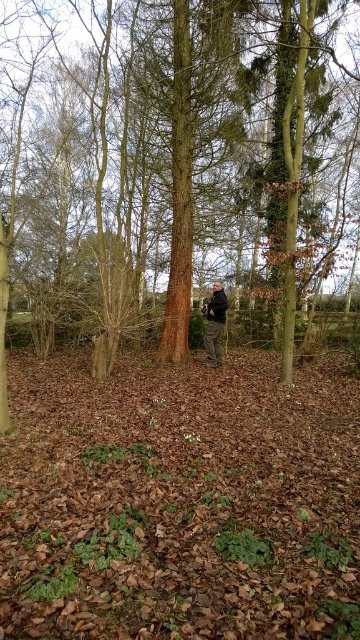
You are a hiker who has just spotted a brown wood tree at center and a dark gray jacket at center in the woods. Based on the scene, which object is higher up in the image?

The brown wood tree at center is above the dark gray jacket at center, so the brown wood tree at center is higher up in the image.

You are a hiker who has just spotted a brown wood tree at center and a dark gray jacket at center in the woodland. You want to retrieve the jacket without getting too close to the tree. Can you safely pick up the jacket from 4 meters away?

The distance between the brown wood tree at center and the dark gray jacket at center is 4.25 meters. Since you want to stay at least 4 meters away from the tree, you can safely pick up the jacket as it is just 0.25 meters beyond your desired distance.

You are standing in the woodland scene and want to reach the point marked as point [286,356]. If your walking speed is 1.2 meters per second, how many seconds will it take you to reach that point?

The point [286,356] is 8.44 meters from camera. At a walking speed of 1.2 meters per second, it will take approximately 7.03 seconds to reach the point.